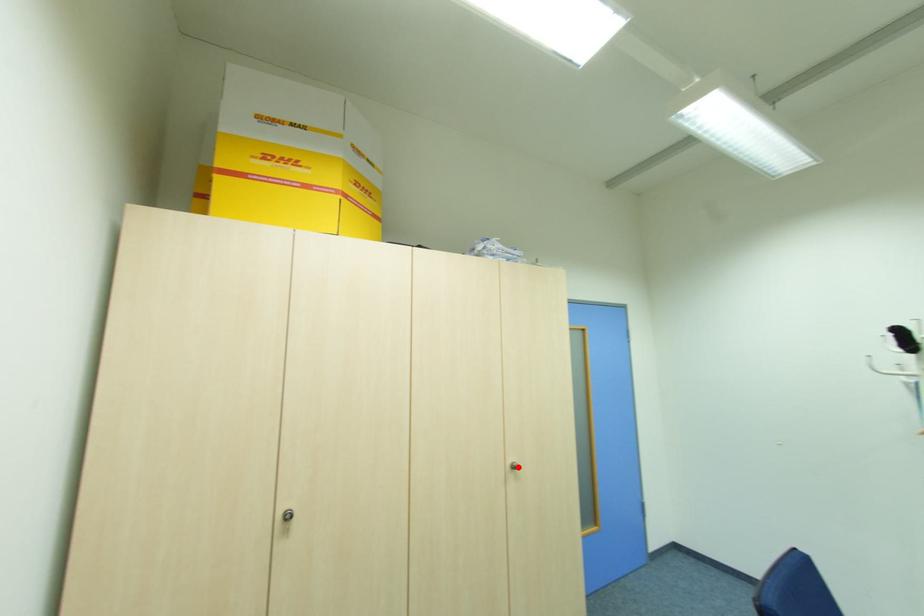
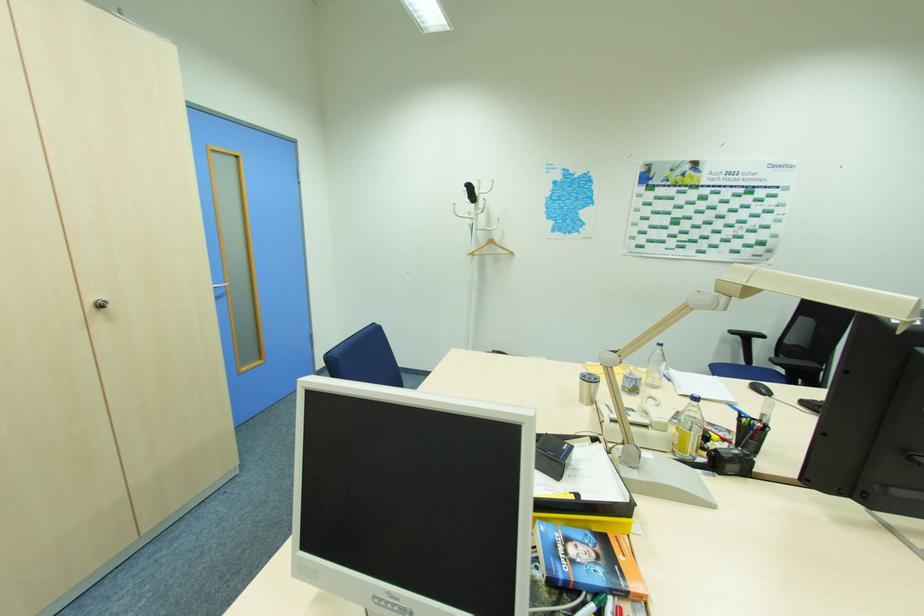
Where in the second image is the point corresponding to the highlighted location from the first image?

(103, 306)